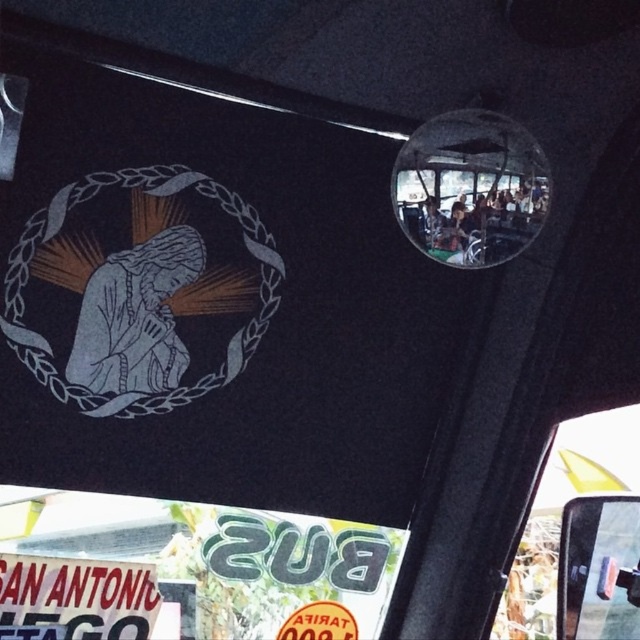
Question: Is the position of matte silver emblem at center less distant than that of white matte sign at lower left?

Choices:
 (A) no
 (B) yes

Answer: (B)

Question: Which point is closer to the camera taking this photo?

Choices:
 (A) (100, 628)
 (B) (115, 342)
 (C) (528, 547)

Answer: (B)

Question: Is transparent glass window at lower right below white matte sign at lower left?

Choices:
 (A) no
 (B) yes

Answer: (A)

Question: Is transparent glass window at lower right to the right of white matte sign at lower left from the viewer's perspective?

Choices:
 (A) no
 (B) yes

Answer: (B)

Question: Which point is farther to the camera?

Choices:
 (A) (637, 429)
 (B) (170, 369)

Answer: (A)

Question: Which point is farther to the camera?

Choices:
 (A) (52, 564)
 (B) (243, 252)
 (C) (582, 451)

Answer: (C)